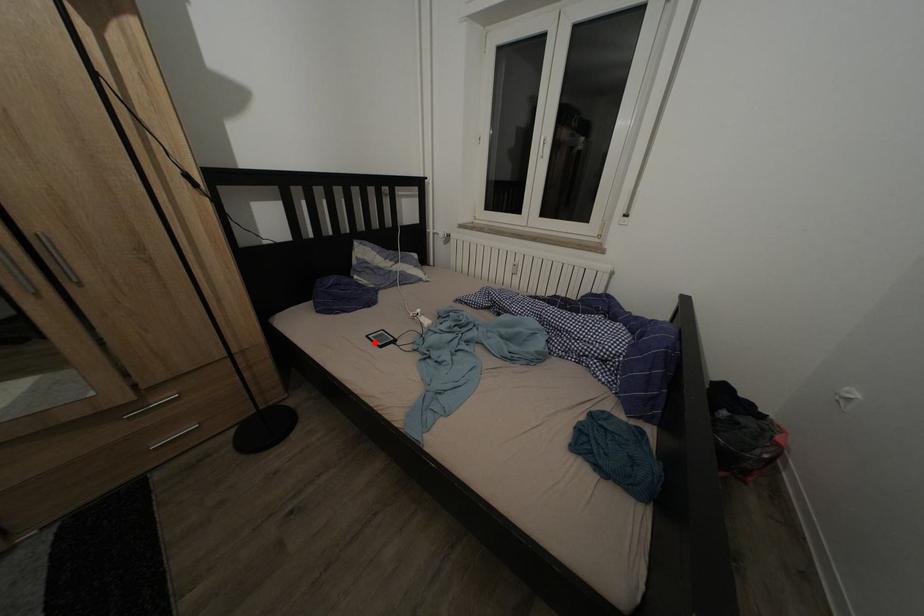
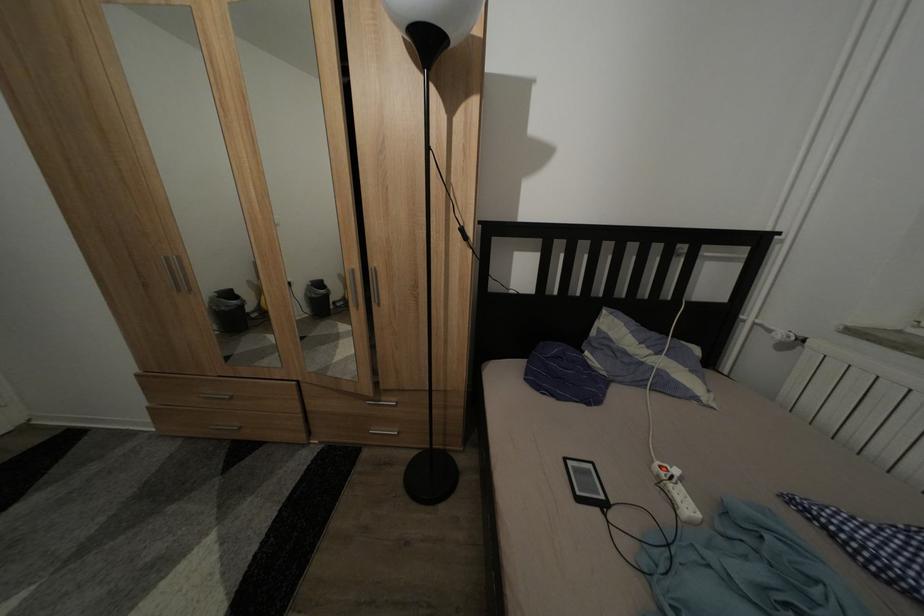
In the second image, find the point that corresponds to the highlighted location in the first image.

(573, 466)